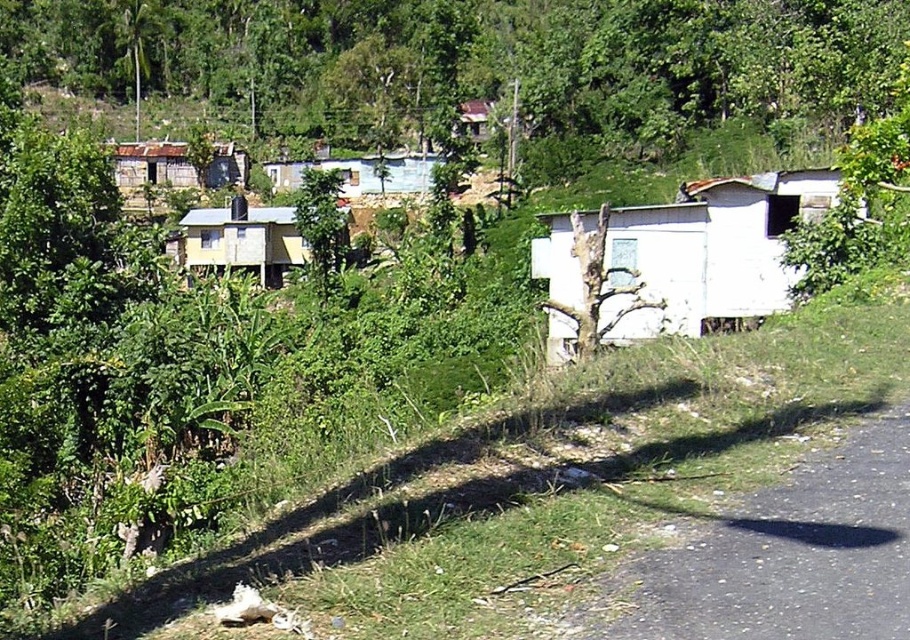
Who is positioned more to the right, white corrugated metal hut at center-right or yellow corrugated metal hut at center?

white corrugated metal hut at center-right

Consider the image. Does white corrugated metal hut at center-right have a lesser height compared to yellow corrugated metal hut at center?

Correct, white corrugated metal hut at center-right is not as tall as yellow corrugated metal hut at center.

Locate an element on the screen. This screenshot has height=640, width=910. white corrugated metal hut at center-right is located at coordinates (709, 252).

Where is `yellow corrugated metal hut at center`? Image resolution: width=910 pixels, height=640 pixels. yellow corrugated metal hut at center is located at coordinates (244, 240).

Is point (206, 218) less distant than point (233, 168)?

Yes, point (206, 218) is in front of point (233, 168).

Image resolution: width=910 pixels, height=640 pixels. In order to click on yellow corrugated metal hut at center in this screenshot , I will do `click(244, 240)`.

Can you confirm if white corrugated metal hut at center-right is shorter than rusty corrugated metal hut at center-left?

Yes.

How distant is white corrugated metal hut at center-right from rusty corrugated metal hut at center-left?

A distance of 65.36 meters exists between white corrugated metal hut at center-right and rusty corrugated metal hut at center-left.

Which is behind, point (750, 180) or point (236, 172)?

Point (236, 172)

Find the location of a particular element. The height and width of the screenshot is (640, 910). white corrugated metal hut at center-right is located at coordinates (709, 252).